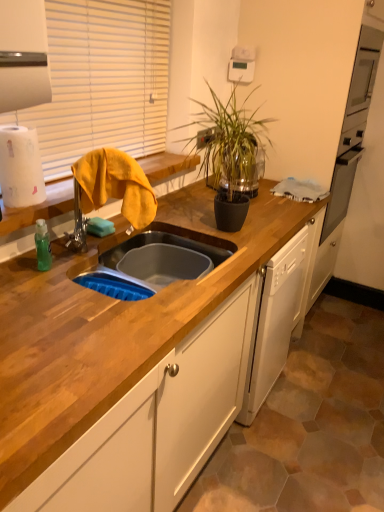
Question: Is green glossy plant at center taller than wooden at left?

Choices:
 (A) yes
 (B) no

Answer: (A)

Question: Is green glossy plant at center next to wooden at left?

Choices:
 (A) no
 (B) yes

Answer: (A)

Question: Is green glossy plant at center looking in the opposite direction of wooden at left?

Choices:
 (A) no
 (B) yes

Answer: (B)

Question: Considering the relative positions of green glossy plant at center and wooden at left in the image provided, is green glossy plant at center to the right of wooden at left from the viewer's perspective?

Choices:
 (A) no
 (B) yes

Answer: (B)

Question: From a real-world perspective, is green glossy plant at center located higher than wooden at left?

Choices:
 (A) no
 (B) yes

Answer: (B)

Question: Relative to green glossy plant at center, is yellow fabric at left in front or behind?

Choices:
 (A) front
 (B) behind

Answer: (A)

Question: Considering the positions of yellow fabric at left and green glossy plant at center in the image, is yellow fabric at left bigger or smaller than green glossy plant at center?

Choices:
 (A) big
 (B) small

Answer: (A)

Question: Considering the positions of yellow fabric at left and green glossy plant at center in the image, is yellow fabric at left wider or thinner than green glossy plant at center?

Choices:
 (A) thin
 (B) wide

Answer: (A)

Question: From their relative heights in the image, would you say yellow fabric at left is taller or shorter than green glossy plant at center?

Choices:
 (A) short
 (B) tall

Answer: (B)

Question: Do you think wooden countertop at center is within yellow fabric at left, or outside of it?

Choices:
 (A) outside
 (B) inside

Answer: (A)

Question: Does point (243, 300) appear closer or farther from the camera than point (137, 201)?

Choices:
 (A) closer
 (B) farther

Answer: (B)

Question: In the image, is wooden countertop at center positioned in front of or behind yellow fabric at left?

Choices:
 (A) front
 (B) behind

Answer: (A)

Question: Looking at their shapes, would you say wooden countertop at center is wider or thinner than yellow fabric at left?

Choices:
 (A) wide
 (B) thin

Answer: (A)

Question: Based on their positions, is wooden countertop at center located to the left or right of white matte paper towel at left?

Choices:
 (A) right
 (B) left

Answer: (A)

Question: From a real-world perspective, relative to white matte paper towel at left, is wooden countertop at center vertically above or below?

Choices:
 (A) above
 (B) below

Answer: (B)